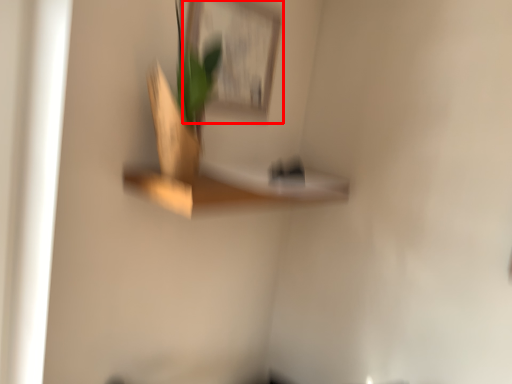
Question: Observing the image, what is the correct spatial positioning of picture frame (annotated by the red box) in reference to shelf?

Choices:
 (A) left
 (B) right

Answer: (A)